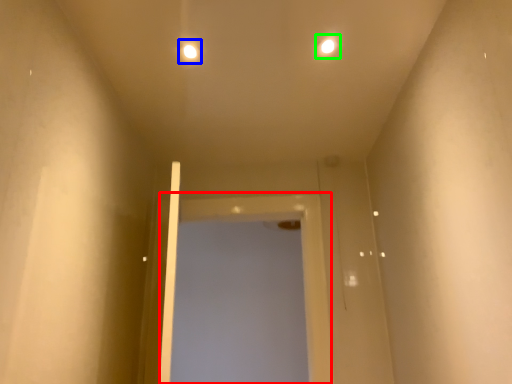
Question: Estimate the real-world distances between objects in this image. Which object is closer to screen door (highlighted by a red box), light (highlighted by a blue box) or light (highlighted by a green box)?

Choices:
 (A) light
 (B) light

Answer: (A)